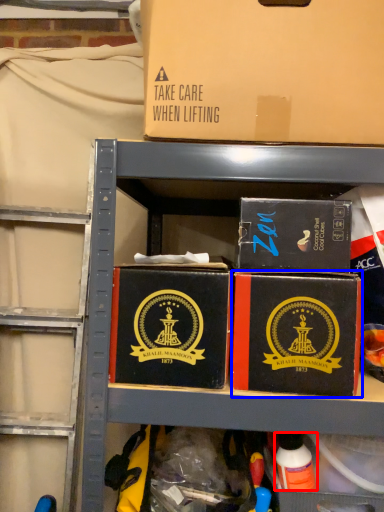
Question: Among these objects, which one is nearest to the camera, toy (highlighted by a red box) or box (highlighted by a blue box)?

Choices:
 (A) toy
 (B) box

Answer: (B)